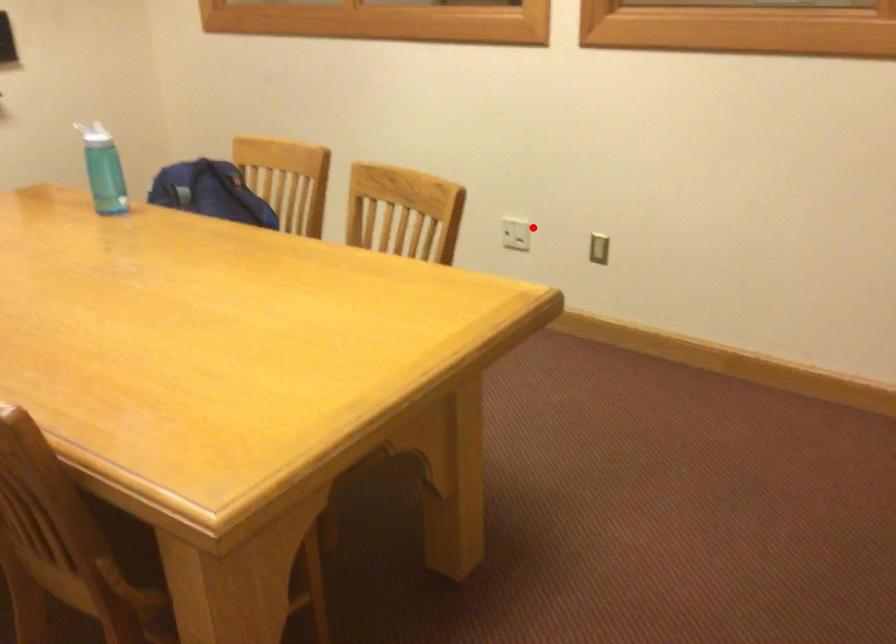
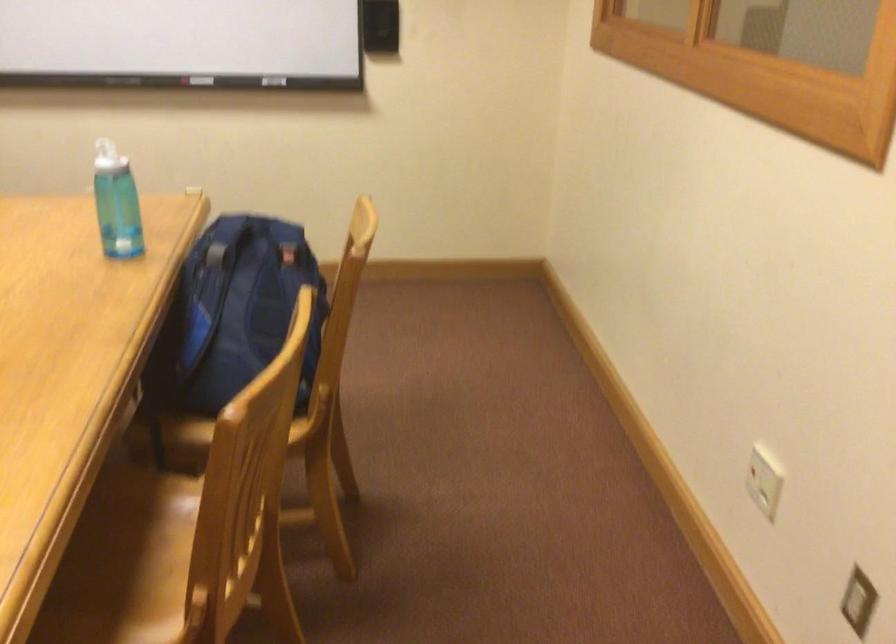
In the second image, find the point that corresponds to the highlighted location in the first image.

(764, 480)